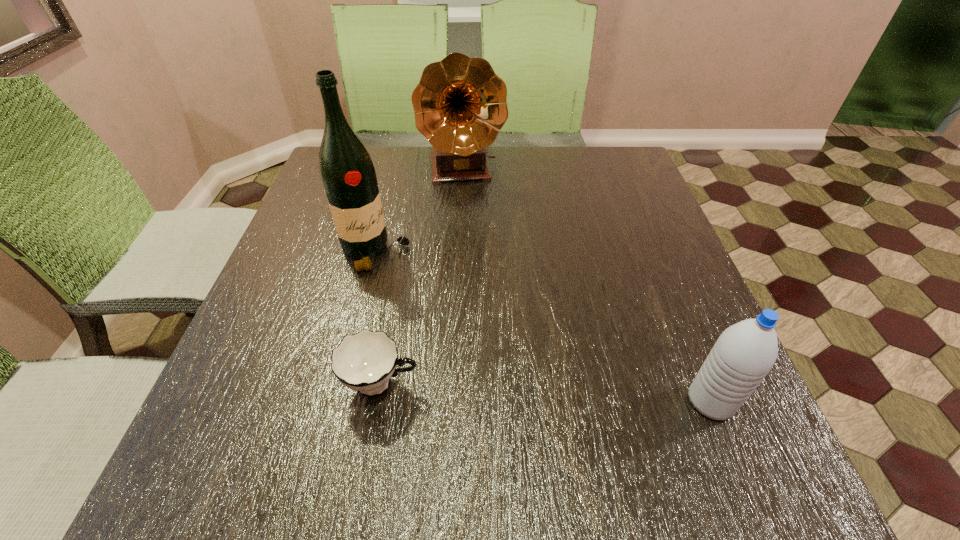
At what (x,y) coordinates should I click in order to perform the action: click on free space between the water bottle and the third nearest object. Please return your answer as a coordinate pair (x, y). The height and width of the screenshot is (540, 960). Looking at the image, I should click on (543, 327).

The height and width of the screenshot is (540, 960). I want to click on free point between the shortest object and the wine bottle, so click(x=378, y=318).

Locate an element on the screen. The width and height of the screenshot is (960, 540). free space between the shortest object and the second farthest object is located at coordinates (378, 318).

Where is `vacant area that lies between the third nearest object and the farthest object`? This screenshot has width=960, height=540. vacant area that lies between the third nearest object and the farthest object is located at coordinates (420, 211).

Find the location of a particular element. Image resolution: width=960 pixels, height=540 pixels. empty space that is in between the second farthest object and the shortest object is located at coordinates (378, 318).

I want to click on vacant space that is in between the second shortest object and the wine bottle, so click(x=543, y=327).

The image size is (960, 540). Identify the location of object that is the second closest to the shortest object. (745, 352).

The width and height of the screenshot is (960, 540). Identify the location of object that is the third closest to the shortest object. (460, 106).

Find the location of a particular element. The height and width of the screenshot is (540, 960). vacant space that satisfies the following two spatial constraints: 1. on the front side of the farthest object; 2. on the left side of the rightmost object is located at coordinates coord(453,401).

Image resolution: width=960 pixels, height=540 pixels. I want to click on vacant space that satisfies the following two spatial constraints: 1. on the front side of the cup; 2. on the side of the wine bottle with the handle, so click(343, 384).